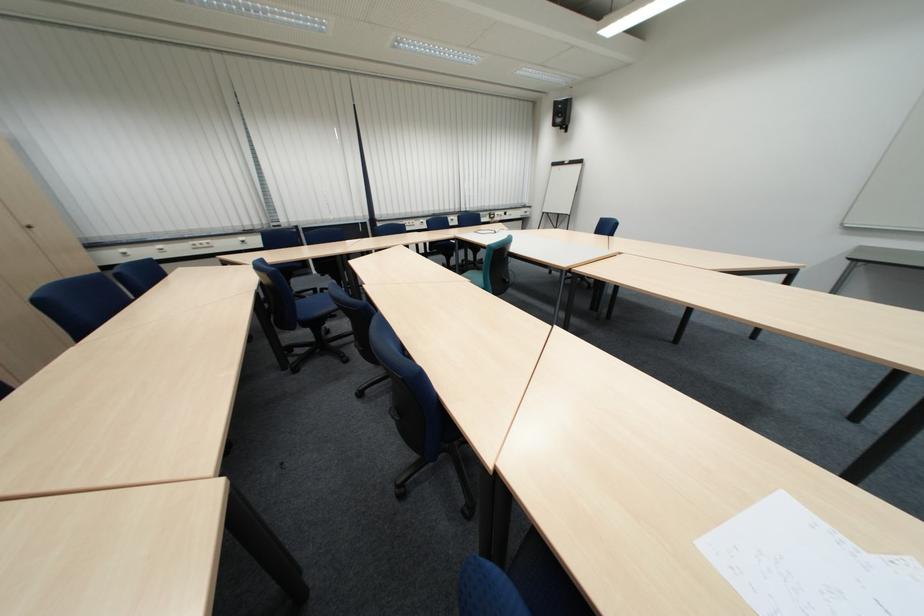
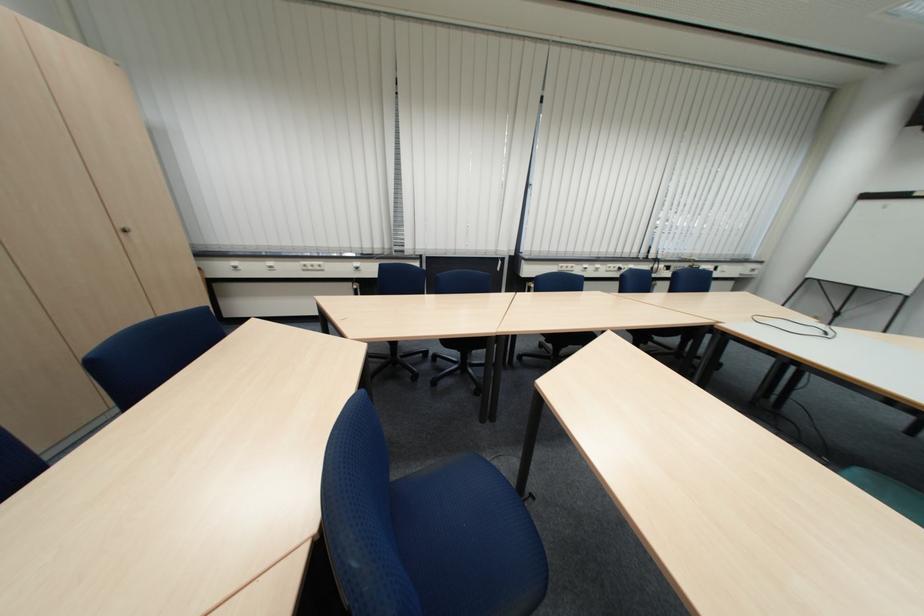
The images are taken continuously from a first-person perspective. In which direction are you moving?

The cameraman moved toward left, forward.